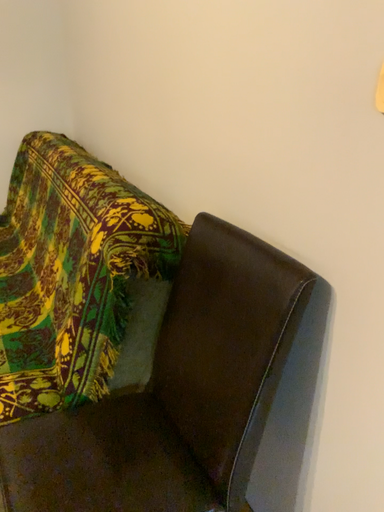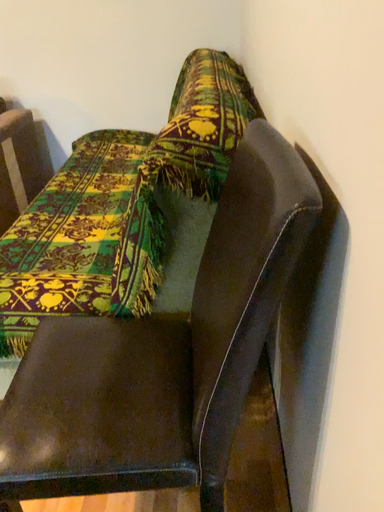
Question: How did the camera likely rotate when shooting the video?

Choices:
 (A) rotated right
 (B) rotated left

Answer: (B)